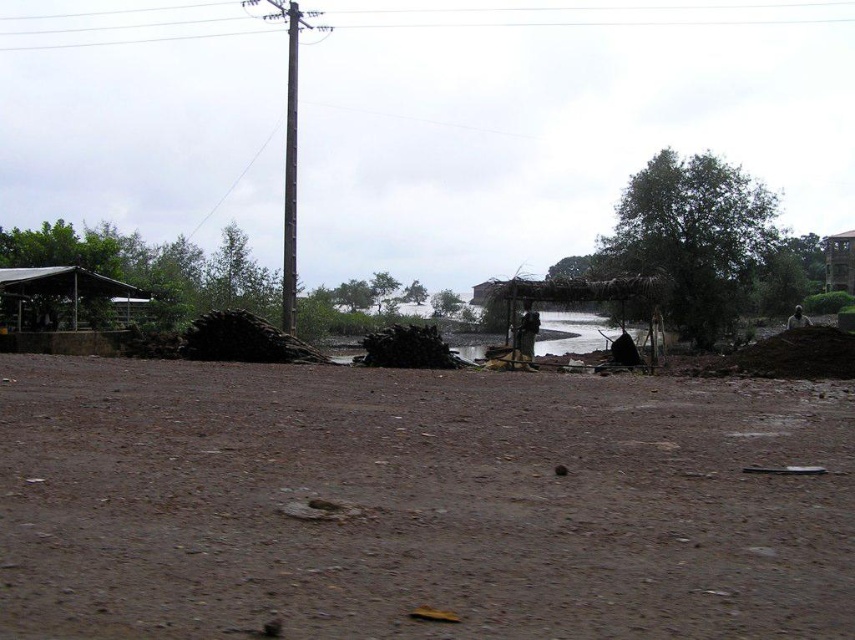
You are a hiker trying to cross the brown mud at center and the smooth gray pole at center. Which object should you step on first to reach the other side?

You should step on the brown mud at center first because it is closer to you than the smooth gray pole at center.

You are a photographer planning to capture the entire scene in one shot. Considering the brushed metal power line at upper center and the wooden thatched hut at right, which object will appear bigger in your photo?

The brushed metal power line at upper center will appear bigger in the photo because it is larger in size than the wooden thatched hut at right.